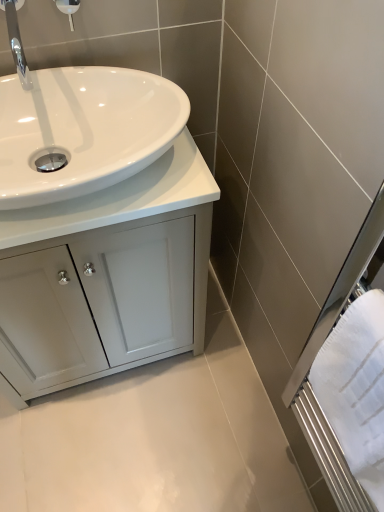
Question: From a real-world perspective, is white glossy cabinet at lower left physically above polished chrome faucet at upper left?

Choices:
 (A) no
 (B) yes

Answer: (A)

Question: Can you confirm if white glossy cabinet at lower left is positioned to the left of polished chrome faucet at upper left?

Choices:
 (A) yes
 (B) no

Answer: (B)

Question: Is white glossy cabinet at lower left turned away from polished chrome faucet at upper left?

Choices:
 (A) yes
 (B) no

Answer: (B)

Question: Is white glossy cabinet at lower left far from polished chrome faucet at upper left?

Choices:
 (A) yes
 (B) no

Answer: (B)

Question: From the image's perspective, would you say white glossy cabinet at lower left is positioned over polished chrome faucet at upper left?

Choices:
 (A) no
 (B) yes

Answer: (A)

Question: Is white glossy cabinet at lower left outside polished chrome faucet at upper left?

Choices:
 (A) yes
 (B) no

Answer: (A)

Question: Is white glossy cabinet at lower left not near white glossy shower head at upper left?

Choices:
 (A) no
 (B) yes

Answer: (A)

Question: Is the depth of white glossy cabinet at lower left less than that of white glossy shower head at upper left?

Choices:
 (A) yes
 (B) no

Answer: (A)

Question: Can you confirm if white glossy cabinet at lower left is wider than white glossy shower head at upper left?

Choices:
 (A) yes
 (B) no

Answer: (A)

Question: Can you confirm if white glossy cabinet at lower left is positioned to the left of white glossy shower head at upper left?

Choices:
 (A) no
 (B) yes

Answer: (B)

Question: Is white glossy cabinet at lower left aimed at white glossy shower head at upper left?

Choices:
 (A) yes
 (B) no

Answer: (B)

Question: Does white glossy cabinet at lower left appear on the right side of white glossy shower head at upper left?

Choices:
 (A) no
 (B) yes

Answer: (A)

Question: From a real-world perspective, is polished chrome faucet at upper left below white glossy shower head at upper left?

Choices:
 (A) yes
 (B) no

Answer: (B)